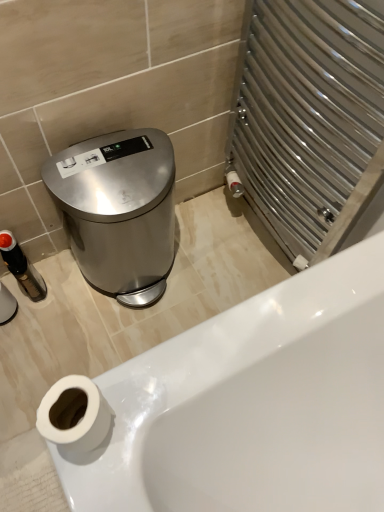
The image size is (384, 512). What are the coordinates of `free location in front of polished stainless steel trash can at left` in the screenshot? It's located at (100, 340).